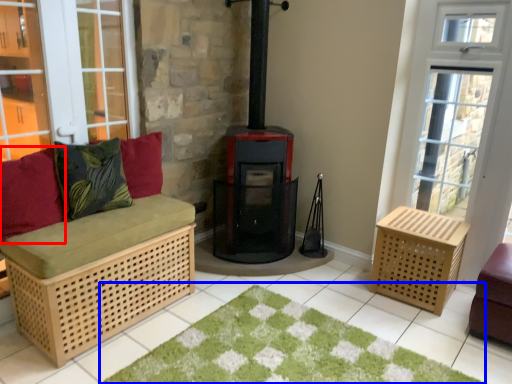
Question: Which object is further to the camera taking this photo, pillow (highlighted by a red box) or doormat (highlighted by a blue box)?

Choices:
 (A) pillow
 (B) doormat

Answer: (A)